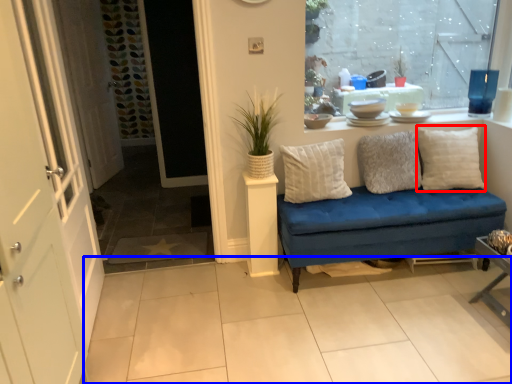
Question: Which object is further to the camera taking this photo, pillow (highlighted by a red box) or tile (highlighted by a blue box)?

Choices:
 (A) pillow
 (B) tile

Answer: (A)